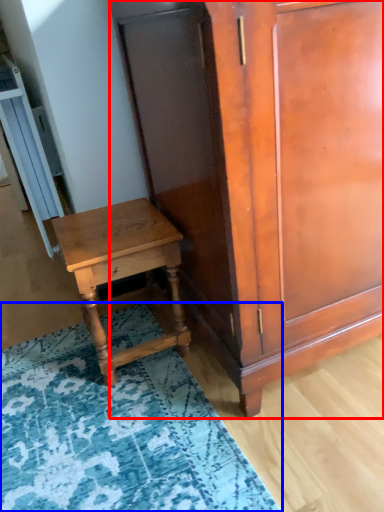
Question: Which point is closer to the camera, cabinetry (highlighted by a red box) or mat (highlighted by a blue box)?

Choices:
 (A) cabinetry
 (B) mat

Answer: (A)